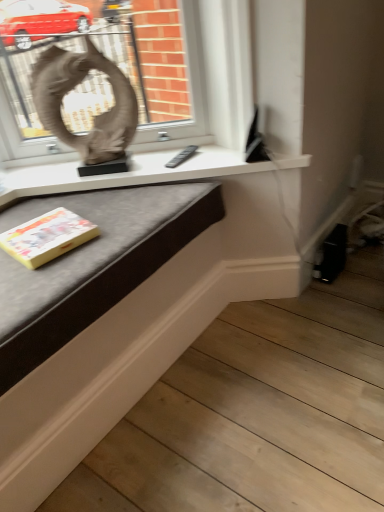
Question: Is yellow paper at lower left wider or thinner than matte white table at center?

Choices:
 (A) wide
 (B) thin

Answer: (B)

Question: Is yellow paper at lower left to the left or to the right of matte white table at center in the image?

Choices:
 (A) right
 (B) left

Answer: (B)

Question: Estimate the real-world distances between objects in this image. Which object is closer to the yellow paper at lower left?

Choices:
 (A) matte white table at center
 (B) matte gray sculpture at upper left

Answer: (A)

Question: Based on their relative distances, which object is farther from the matte gray sculpture at upper left?

Choices:
 (A) matte white table at center
 (B) yellow paper at lower left

Answer: (B)